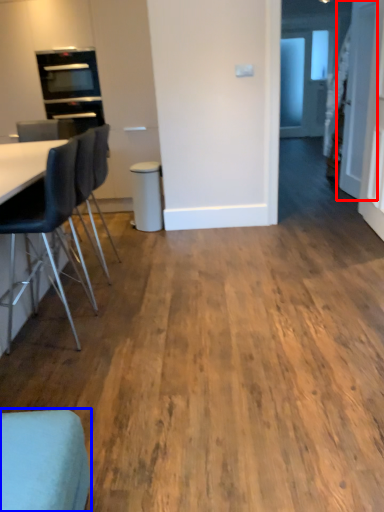
Question: Which object appears closest to the camera in this image, door (highlighted by a red box) or chair (highlighted by a blue box)?

Choices:
 (A) door
 (B) chair

Answer: (B)